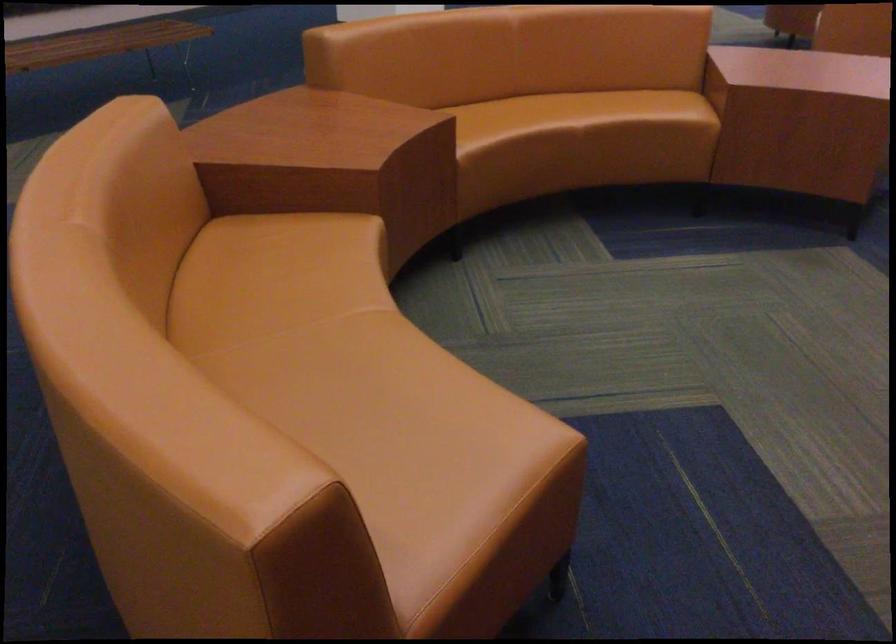
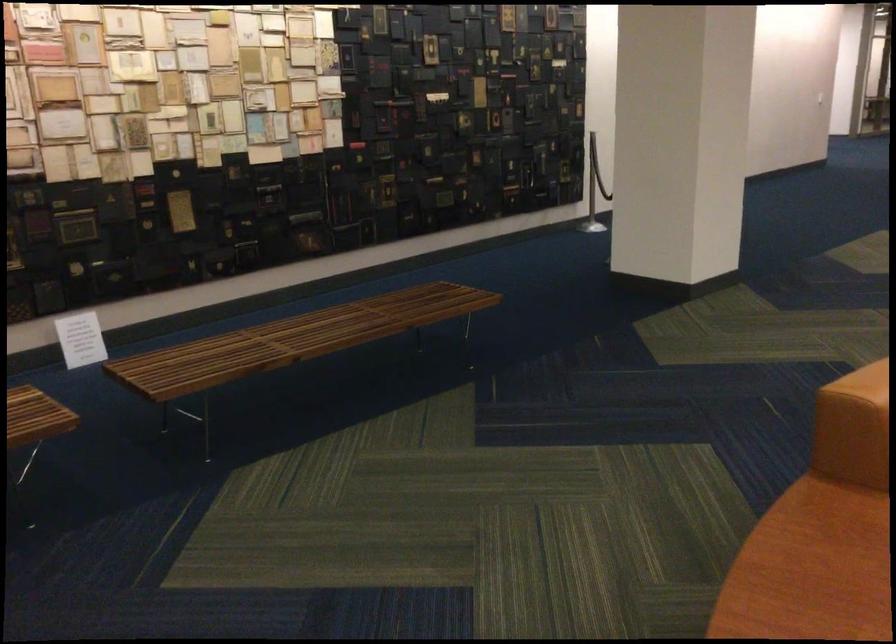
Where in the second image is the point corresponding to (x=262, y=120) from the first image?

(808, 570)